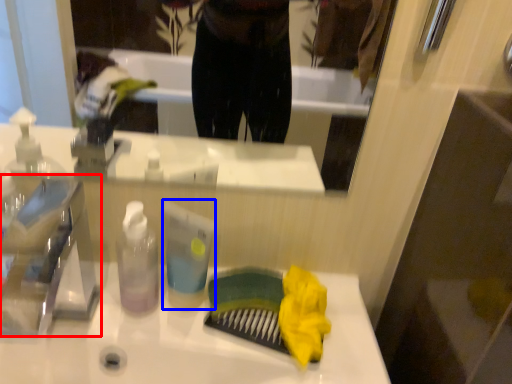
Question: Which object appears farthest to the camera in this image, faucet (highlighted by a red box) or toiletry (highlighted by a blue box)?

Choices:
 (A) faucet
 (B) toiletry

Answer: (B)